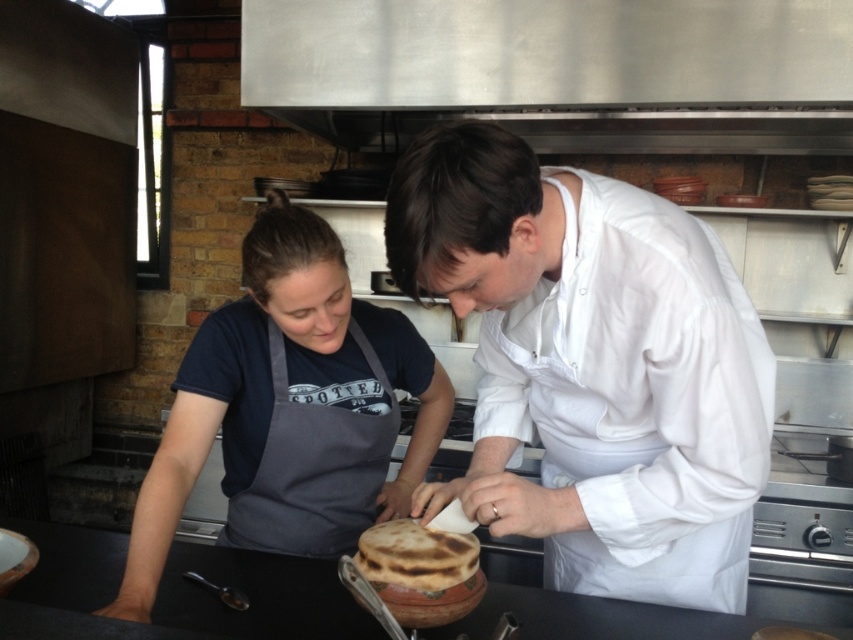
You are a fashion designer observing the two individuals in the kitchen scene. You need to determine which garment has a greater width between the white matte chef coat at center and the dark gray apron at center. Which one is wider?

The white matte chef coat at center is wider than the dark gray apron at center according to the description.

You are a food safety inspector checking the kitchen. You notice the dark gray apron at center and the brown matte flatbread at center. According to food safety guidelines, should the apron be above the flatbread? Explain your reasoning.

The dark gray apron at center is located above the brown matte flatbread at center. Since food safety guidelines require that aprons or clothing should not be positioned above food to prevent contamination, this placement is not compliant. The apron should be moved below or away from the flatbread.